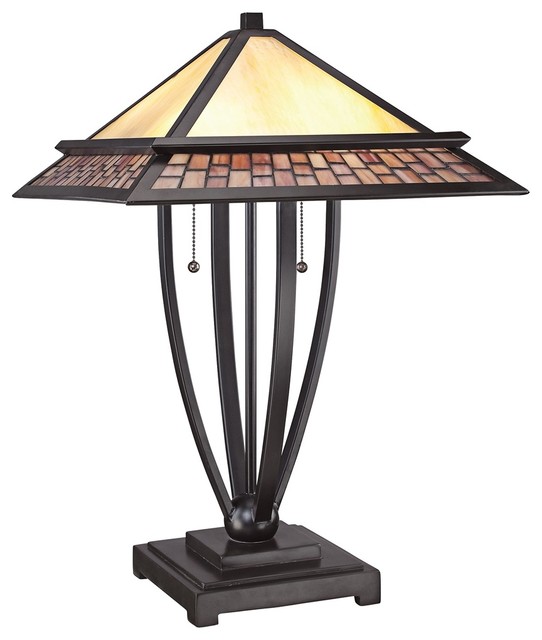
Image resolution: width=542 pixels, height=640 pixels. I want to click on yellow glass lamp cover, so click(x=256, y=83), click(x=178, y=96).